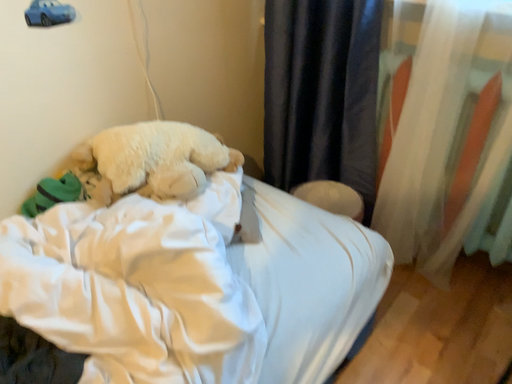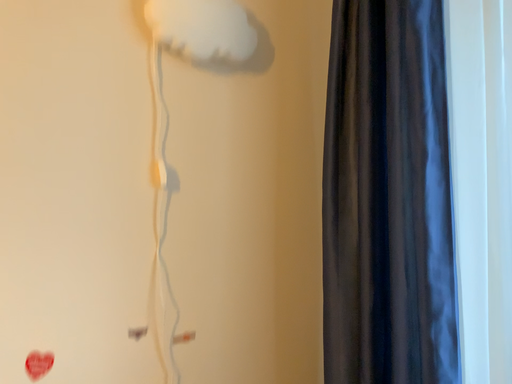
Question: How did the camera likely rotate when shooting the video?

Choices:
 (A) rotated right
 (B) rotated left

Answer: (B)